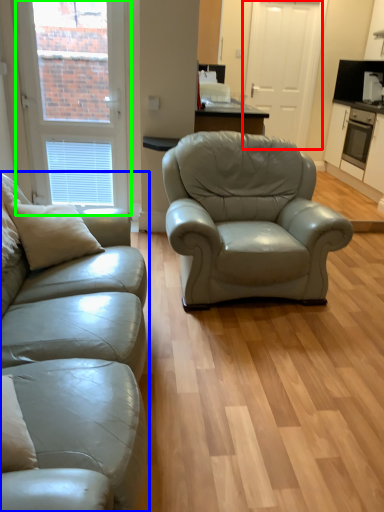
Question: Considering the real-world distances, which object is closest to screen door (highlighted by a red box)? studio couch (highlighted by a blue box) or window (highlighted by a green box).

Choices:
 (A) studio couch
 (B) window

Answer: (B)